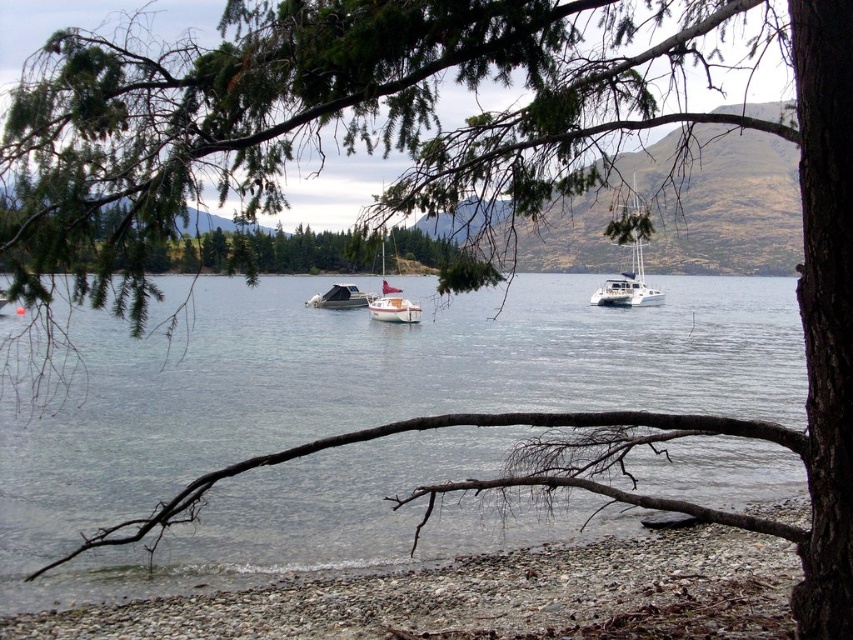
Question: Which of these objects is positioned farthest from the clear water at center?

Choices:
 (A) white glossy catamaran at center
 (B) matte white sailboat at center

Answer: (B)

Question: Estimate the real-world distances between objects in this image. Which object is closer to the white glossy catamaran at center?

Choices:
 (A) white glossy sailboat at center
 (B) smooth pebbles at lower left
 (C) clear water at center
 (D) matte white sailboat at center

Answer: (C)

Question: In this image, where is clear water at center located relative to white glossy catamaran at center?

Choices:
 (A) left
 (B) right

Answer: (A)

Question: Does smooth pebbles at lower left come behind white glossy catamaran at center?

Choices:
 (A) yes
 (B) no

Answer: (A)

Question: Does white glossy catamaran at center have a lesser width compared to white glossy sailboat at center?

Choices:
 (A) yes
 (B) no

Answer: (B)

Question: Which point is closer to the camera?

Choices:
 (A) (575, 611)
 (B) (326, 301)

Answer: (A)